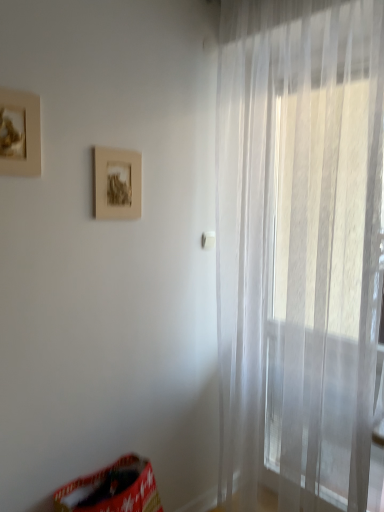
The image size is (384, 512). What do you see at coordinates (112, 489) in the screenshot?
I see `red fabric bean bag chair at lower left` at bounding box center [112, 489].

Measure the distance between point [125,186] and camera.

Point [125,186] and camera are 5.43 feet apart.

I want to click on red fabric bean bag chair at lower left, so click(112, 489).

Could you tell me if matte brown picture frame at center, which is the second picture frame from front to back, is facing transparent fabric curtain at right?

→ No, matte brown picture frame at center, which is the second picture frame from front to back, is not aimed at transparent fabric curtain at right.

Is point (125, 204) positioned behind point (290, 104)?

That is True.

From the picture: Who is shorter, matte brown picture frame at center, which is the second picture frame from left to right, or transparent fabric curtain at right?

matte brown picture frame at center, which is the second picture frame from left to right, is shorter.

From the image's perspective, is matte brown picture frame at center, which is the first picture frame from back to front, below transparent fabric curtain at right?

Incorrect, from the image's perspective, matte brown picture frame at center, which is the first picture frame from back to front, is higher than transparent fabric curtain at right.

From the image's perspective, which object appears higher, transparent fabric curtain at right or red fabric bean bag chair at lower left?

From the image's view, transparent fabric curtain at right is above.

Between transparent fabric curtain at right and red fabric bean bag chair at lower left, which one has larger width?

red fabric bean bag chair at lower left.

How different are the orientations of transparent fabric curtain at right and red fabric bean bag chair at lower left in degrees?

The angular difference between transparent fabric curtain at right and red fabric bean bag chair at lower left is 88 degrees.

Does transparent fabric curtain at right touch red fabric bean bag chair at lower left?

No, transparent fabric curtain at right is not making contact with red fabric bean bag chair at lower left.

Who is shorter, red fabric bean bag chair at lower left or matte gold picture frame at upper left, the second picture frame when ordered from right to left?

With less height is matte gold picture frame at upper left, the second picture frame when ordered from right to left.

Which object is positioned more to the right, red fabric bean bag chair at lower left or matte gold picture frame at upper left, which ranks as the first picture frame in front-to-back order?

From the viewer's perspective, red fabric bean bag chair at lower left appears more on the right side.

What's the angular difference between red fabric bean bag chair at lower left and matte gold picture frame at upper left, acting as the 1th picture frame starting from the left,'s facing directions?

There is a 1.77-degree angle between the facing directions of red fabric bean bag chair at lower left and matte gold picture frame at upper left, acting as the 1th picture frame starting from the left.

Does point (22, 175) come in front of point (271, 249)?

Yes, point (22, 175) is in front of point (271, 249).

Between matte gold picture frame at upper left, which ranks as the first picture frame in front-to-back order, and transparent fabric curtain at right, which one has larger width?

transparent fabric curtain at right is wider.

Is transparent fabric curtain at right surrounded by matte gold picture frame at upper left, the second picture frame when ordered from right to left?

No, transparent fabric curtain at right is not a part of matte gold picture frame at upper left, the second picture frame when ordered from right to left.

From the image's perspective, is matte gold picture frame at upper left, the second picture frame when ordered from right to left, below transparent fabric curtain at right?

Actually, matte gold picture frame at upper left, the second picture frame when ordered from right to left, appears above transparent fabric curtain at right in the image.

Considering the positions of objects red fabric bean bag chair at lower left and transparent fabric curtain at right in the image provided, who is in front, red fabric bean bag chair at lower left or transparent fabric curtain at right?

Positioned in front is transparent fabric curtain at right.

What's the angular difference between red fabric bean bag chair at lower left and transparent fabric curtain at right's facing directions?

The angular difference between red fabric bean bag chair at lower left and transparent fabric curtain at right is 88 degrees.

The width and height of the screenshot is (384, 512). I want to click on bean bag chair on the left of transparent fabric curtain at right, so click(x=112, y=489).

Which is more to the left, red fabric bean bag chair at lower left or transparent fabric curtain at right?

Positioned to the left is red fabric bean bag chair at lower left.

Can you confirm if matte gold picture frame at upper left, which is the 2th picture frame from back to front, is positioned to the left of matte brown picture frame at center, the 1th picture frame from the right?

Yes.

Is matte gold picture frame at upper left, acting as the 1th picture frame starting from the left, next to matte brown picture frame at center, the 1th picture frame from the right, and touching it?

matte gold picture frame at upper left, acting as the 1th picture frame starting from the left, is not next to matte brown picture frame at center, the 1th picture frame from the right, and they're not touching.

In terms of width, does matte gold picture frame at upper left, the second picture frame when ordered from right to left, look wider or thinner when compared to matte brown picture frame at center, the 1th picture frame from the right?

Considering their sizes, matte gold picture frame at upper left, the second picture frame when ordered from right to left, looks broader than matte brown picture frame at center, the 1th picture frame from the right.

This screenshot has width=384, height=512. What are the coordinates of `picture frame below the matte gold picture frame at upper left, which ranks as the first picture frame in front-to-back order (from a real-world perspective)` in the screenshot? It's located at (117, 183).

Is red fabric bean bag chair at lower left taller than matte brown picture frame at center, which is the second picture frame from front to back?

Yes, red fabric bean bag chair at lower left is taller than matte brown picture frame at center, which is the second picture frame from front to back.

Locate an element on the screen. bean bag chair in front of the matte brown picture frame at center, the 1th picture frame from the right is located at coordinates (112, 489).

Is red fabric bean bag chair at lower left facing towards matte brown picture frame at center, the 1th picture frame from the right?

No, red fabric bean bag chair at lower left does not turn towards matte brown picture frame at center, the 1th picture frame from the right.

You are a GUI agent. You are given a task and a screenshot of the screen. Output one action in this format:
    pyautogui.click(x=<x>, y=<y>)
    Task: Click on the curtain in front of the matte brown picture frame at center, the 1th picture frame from the right
    The width and height of the screenshot is (384, 512).
    Given the screenshot: What is the action you would take?
    pyautogui.click(x=298, y=246)

Identify the location of bean bag chair behind the transparent fabric curtain at right. Image resolution: width=384 pixels, height=512 pixels. (112, 489).

Looking at the image, which one is located further to red fabric bean bag chair at lower left, transparent fabric curtain at right or matte brown picture frame at center, which is the second picture frame from left to right?

Based on the image, matte brown picture frame at center, which is the second picture frame from left to right, appears to be further to red fabric bean bag chair at lower left.

Which object lies further to the anchor point matte gold picture frame at upper left, which ranks as the first picture frame in front-to-back order, red fabric bean bag chair at lower left or transparent fabric curtain at right?

Based on the image, red fabric bean bag chair at lower left appears to be further to matte gold picture frame at upper left, which ranks as the first picture frame in front-to-back order.

Estimate the real-world distances between objects in this image. Which object is further from transparent fabric curtain at right, red fabric bean bag chair at lower left or matte gold picture frame at upper left, the second picture frame when ordered from right to left?

matte gold picture frame at upper left, the second picture frame when ordered from right to left, is further to transparent fabric curtain at right.

Based on their spatial positions, is matte gold picture frame at upper left, which ranks as the first picture frame in front-to-back order, or matte brown picture frame at center, the 1th picture frame from the right, closer to red fabric bean bag chair at lower left?

The object closer to red fabric bean bag chair at lower left is matte brown picture frame at center, the 1th picture frame from the right.

When comparing their distances from matte gold picture frame at upper left, the second picture frame when ordered from right to left, does transparent fabric curtain at right or red fabric bean bag chair at lower left seem further?

red fabric bean bag chair at lower left is further to matte gold picture frame at upper left, the second picture frame when ordered from right to left.

Which object lies nearer to the anchor point transparent fabric curtain at right, matte gold picture frame at upper left, the second picture frame when ordered from right to left, or matte brown picture frame at center, which is the second picture frame from left to right?

matte brown picture frame at center, which is the second picture frame from left to right, is positioned closer to the anchor transparent fabric curtain at right.

From the image, which object appears to be nearer to transparent fabric curtain at right, matte brown picture frame at center, which is the second picture frame from left to right, or red fabric bean bag chair at lower left?

matte brown picture frame at center, which is the second picture frame from left to right, is positioned closer to the anchor transparent fabric curtain at right.

When comparing their distances from transparent fabric curtain at right, does matte gold picture frame at upper left, which ranks as the first picture frame in front-to-back order, or red fabric bean bag chair at lower left seem further?

Based on the image, matte gold picture frame at upper left, which ranks as the first picture frame in front-to-back order, appears to be further to transparent fabric curtain at right.

The height and width of the screenshot is (512, 384). Identify the location of curtain between matte gold picture frame at upper left, which ranks as the first picture frame in front-to-back order, and red fabric bean bag chair at lower left vertically. (298, 246).

This screenshot has height=512, width=384. Find the location of `picture frame located between matte gold picture frame at upper left, which ranks as the first picture frame in front-to-back order, and transparent fabric curtain at right in the left-right direction`. picture frame located between matte gold picture frame at upper left, which ranks as the first picture frame in front-to-back order, and transparent fabric curtain at right in the left-right direction is located at coordinates (117, 183).

Locate an element on the screen. The image size is (384, 512). picture frame between matte gold picture frame at upper left, which ranks as the first picture frame in front-to-back order, and red fabric bean bag chair at lower left vertically is located at coordinates (117, 183).

The image size is (384, 512). Find the location of `curtain between matte brown picture frame at center, the 1th picture frame from the right, and red fabric bean bag chair at lower left vertically`. curtain between matte brown picture frame at center, the 1th picture frame from the right, and red fabric bean bag chair at lower left vertically is located at coordinates (298, 246).